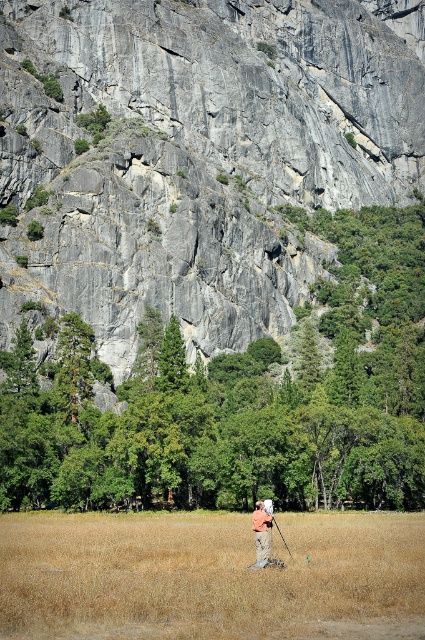
Question: Which of the following is the farthest from the observer?

Choices:
 (A) green leafy tree at upper center
 (B) black matte tripod at center
 (C) camouflage pants at center

Answer: (A)

Question: Is gray rock at upper center bigger than camouflage pants at center?

Choices:
 (A) no
 (B) yes

Answer: (B)

Question: Is camouflage pants at center below black matte tripod at center?

Choices:
 (A) yes
 (B) no

Answer: (A)

Question: Does brown dry grass at center have a lesser width compared to black matte tripod at center?

Choices:
 (A) no
 (B) yes

Answer: (A)

Question: Estimate the real-world distances between objects in this image. Which object is farther from the gray rock at upper center?

Choices:
 (A) brown dry grass at center
 (B) green leafy tree at upper center

Answer: (A)

Question: Among these objects, which one is nearest to the camera?

Choices:
 (A) brown dry grass at center
 (B) camouflage pants at center

Answer: (A)